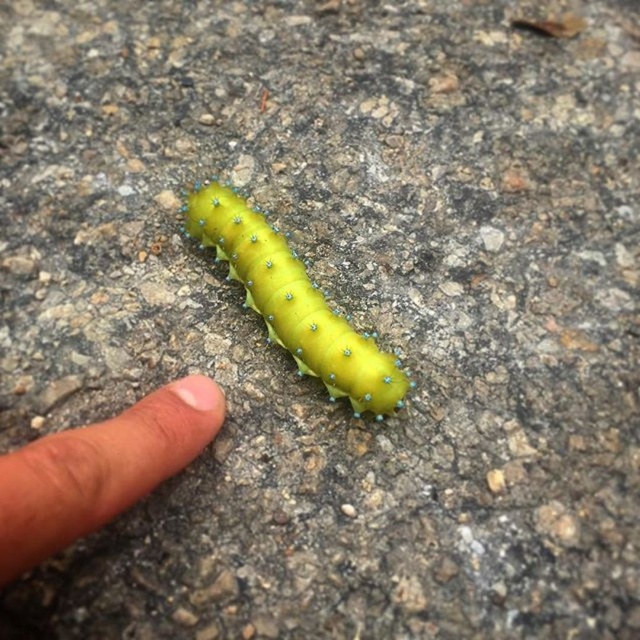
Who is more forward, (x=138, y=426) or (x=237, y=224)?

Positioned in front is point (x=138, y=426).

Can you confirm if flesh-toned skin at lower left is positioned below green matte caterpillar at center?

Indeed, flesh-toned skin at lower left is positioned under green matte caterpillar at center.

Where is `flesh-toned skin at lower left`? This screenshot has height=640, width=640. flesh-toned skin at lower left is located at coordinates (99, 468).